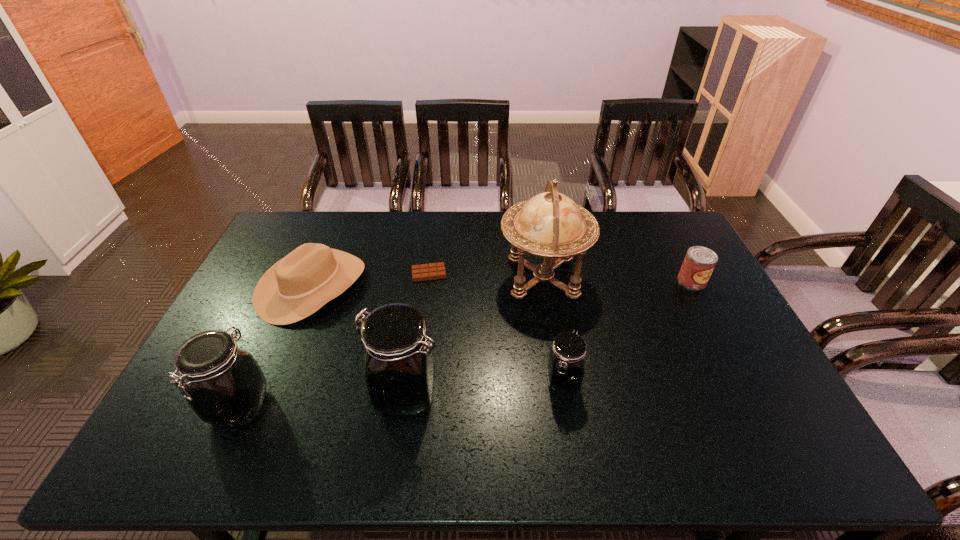
Find the location of `the fifth shortest object`. the fifth shortest object is located at coordinates tap(224, 385).

Locate an element on the screen. The width and height of the screenshot is (960, 540). the second shortest jar is located at coordinates (224, 385).

The image size is (960, 540). Find the location of `the second jar from right to left`. the second jar from right to left is located at coordinates (399, 374).

Where is `the rightmost jar`? Image resolution: width=960 pixels, height=540 pixels. the rightmost jar is located at coordinates (566, 365).

At what (x,y) coordinates should I click in order to perform the action: click on globe. Please return your answer as a coordinate pair (x, y). Looking at the image, I should click on (551, 225).

I want to click on the shortest object, so click(432, 271).

Where is `cowboy hat`? The height and width of the screenshot is (540, 960). cowboy hat is located at coordinates (299, 284).

At what (x,y) coordinates should I click in order to perform the action: click on the second shortest object. Please return your answer as a coordinate pair (x, y). This screenshot has height=540, width=960. Looking at the image, I should click on (698, 265).

This screenshot has width=960, height=540. Identify the location of the rightmost object. (698, 265).

Where is `free space located on the lid of the second jar from left to right`? Image resolution: width=960 pixels, height=540 pixels. free space located on the lid of the second jar from left to right is located at coordinates (241, 394).